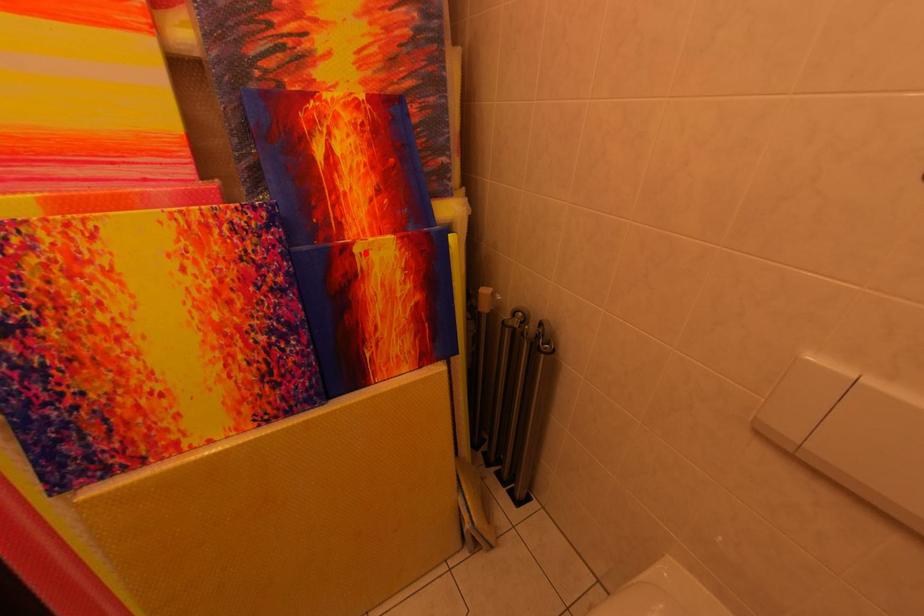
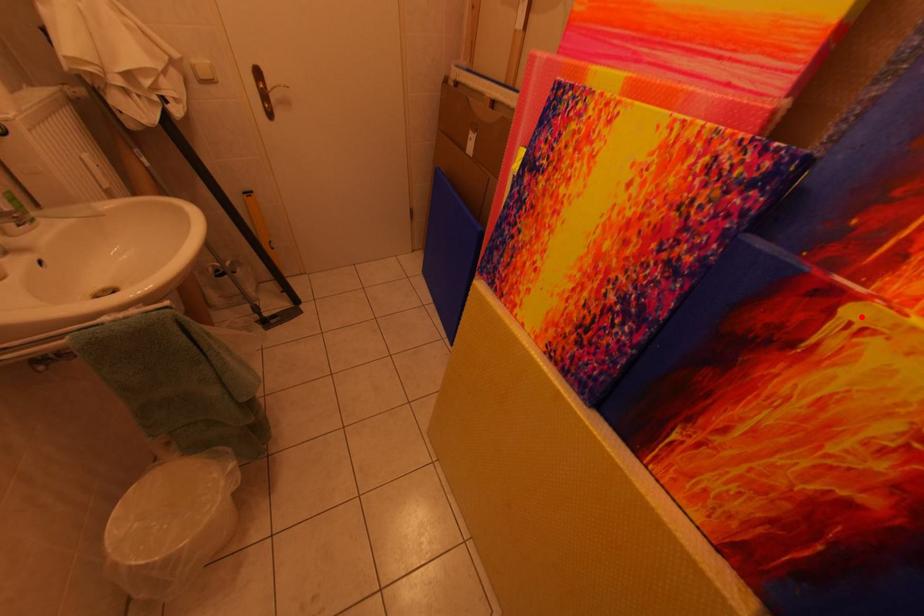
I am providing you with two images of the same scene from different viewpoints. A red point is marked on the first image and another point is marked on the second image. Does the point marked in image1 correspond to the same location as the one in image2?

Yes